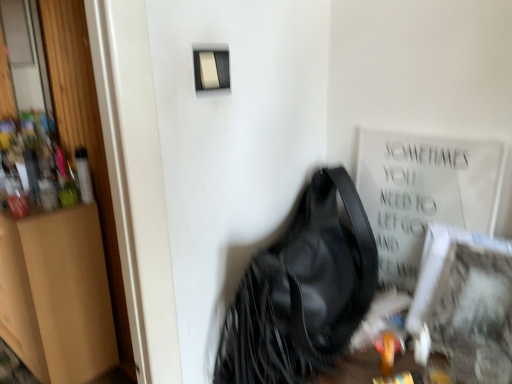
Question: Does white textured frame at lower right have a lesser width compared to brown cardboard dresser at left?

Choices:
 (A) no
 (B) yes

Answer: (B)

Question: Is white textured frame at lower right positioned with its back to brown cardboard dresser at left?

Choices:
 (A) no
 (B) yes

Answer: (A)

Question: Are white textured frame at lower right and brown cardboard dresser at left making contact?

Choices:
 (A) yes
 (B) no

Answer: (B)

Question: Does white textured frame at lower right have a greater width compared to brown cardboard dresser at left?

Choices:
 (A) no
 (B) yes

Answer: (A)

Question: Can you confirm if white textured frame at lower right is smaller than brown cardboard dresser at left?

Choices:
 (A) no
 (B) yes

Answer: (B)

Question: From the image's perspective, relative to brown cardboard dresser at left, is black leather handbag at center above or below?

Choices:
 (A) above
 (B) below

Answer: (A)

Question: From their relative heights in the image, would you say black leather handbag at center is taller or shorter than brown cardboard dresser at left?

Choices:
 (A) tall
 (B) short

Answer: (B)

Question: Looking at the image, does black leather handbag at center seem bigger or smaller compared to brown cardboard dresser at left?

Choices:
 (A) big
 (B) small

Answer: (B)

Question: Is black leather handbag at center inside or outside of brown cardboard dresser at left?

Choices:
 (A) inside
 (B) outside

Answer: (B)

Question: In terms of size, does white textured frame at lower right appear bigger or smaller than black leather handbag at center?

Choices:
 (A) big
 (B) small

Answer: (B)

Question: From a real-world perspective, is white textured frame at lower right physically located above or below black leather handbag at center?

Choices:
 (A) above
 (B) below

Answer: (A)

Question: Is white textured frame at lower right wider or thinner than black leather handbag at center?

Choices:
 (A) thin
 (B) wide

Answer: (A)

Question: Considering the relative positions of white textured frame at lower right and black leather handbag at center in the image provided, is white textured frame at lower right to the left or to the right of black leather handbag at center?

Choices:
 (A) left
 (B) right

Answer: (B)

Question: Relative to black leather handbag at center, is brown cardboard dresser at left in front or behind?

Choices:
 (A) front
 (B) behind

Answer: (B)

Question: Is brown cardboard dresser at left inside the boundaries of black leather handbag at center, or outside?

Choices:
 (A) inside
 (B) outside

Answer: (B)